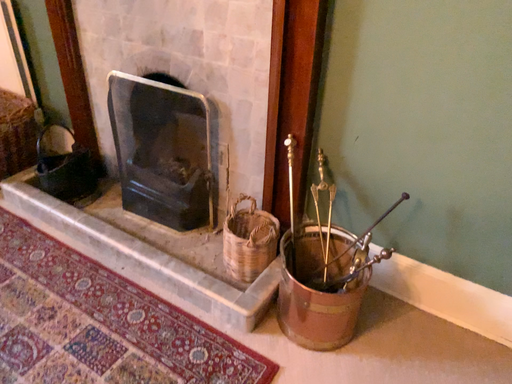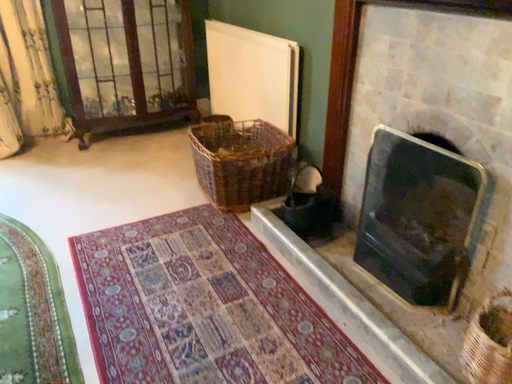
Question: How did the camera likely rotate when shooting the video?

Choices:
 (A) rotated right
 (B) rotated left

Answer: (B)